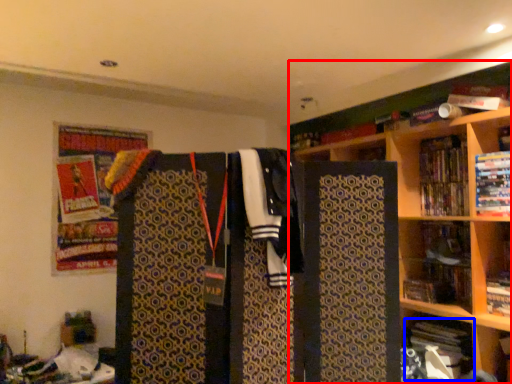
Question: Which of the following is the closest to the observer, bookcase (highlighted by a red box) or book (highlighted by a blue box)?

Choices:
 (A) bookcase
 (B) book

Answer: (A)